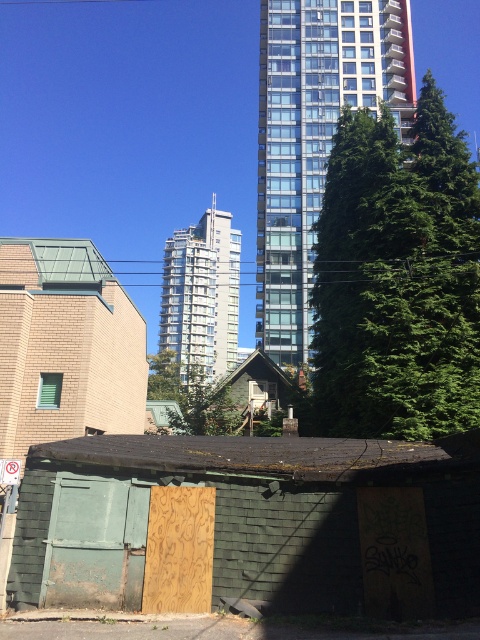
Question: Does green shingled shed at lower left appear over glassy concrete building at center?

Choices:
 (A) no
 (B) yes

Answer: (A)

Question: Considering the relative positions of green shingled shed at lower left and glassy concrete building at upper center in the image provided, where is green shingled shed at lower left located with respect to glassy concrete building at upper center?

Choices:
 (A) left
 (B) right

Answer: (A)

Question: Which point appears farthest from the camera in this image?

Choices:
 (A) (309, 52)
 (B) (347, 451)
 (C) (216, 244)

Answer: (C)

Question: Is green shingled shed at lower left behind glassy concrete building at upper center?

Choices:
 (A) yes
 (B) no

Answer: (B)

Question: Which point is farther to the camera?

Choices:
 (A) click(335, 1)
 (B) click(187, 346)

Answer: (B)

Question: Estimate the real-world distances between objects in this image. Which object is closer to the green shingled shed at lower left?

Choices:
 (A) glassy concrete building at upper center
 (B) glassy concrete building at center

Answer: (A)